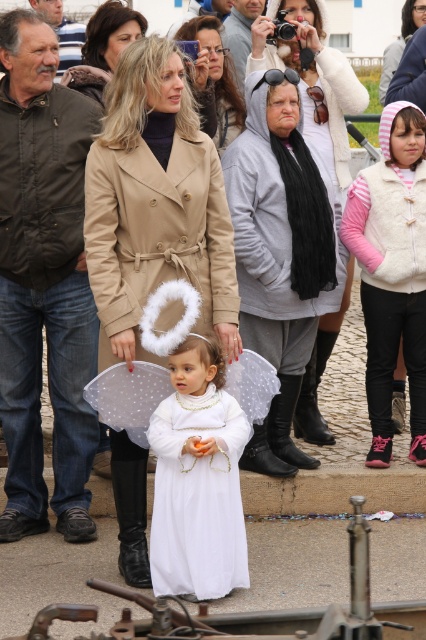
You are a photographer at the event and need to position a light to the right of both the matte beige coat at center and the smooth beige coat at center. Which coat should you place the light closer to?

The light should be placed closer to the smooth beige coat at center because the matte beige coat at center is to the left of it, so positioning the light to the right of both would require placing it closer to the smooth beige coat at center.